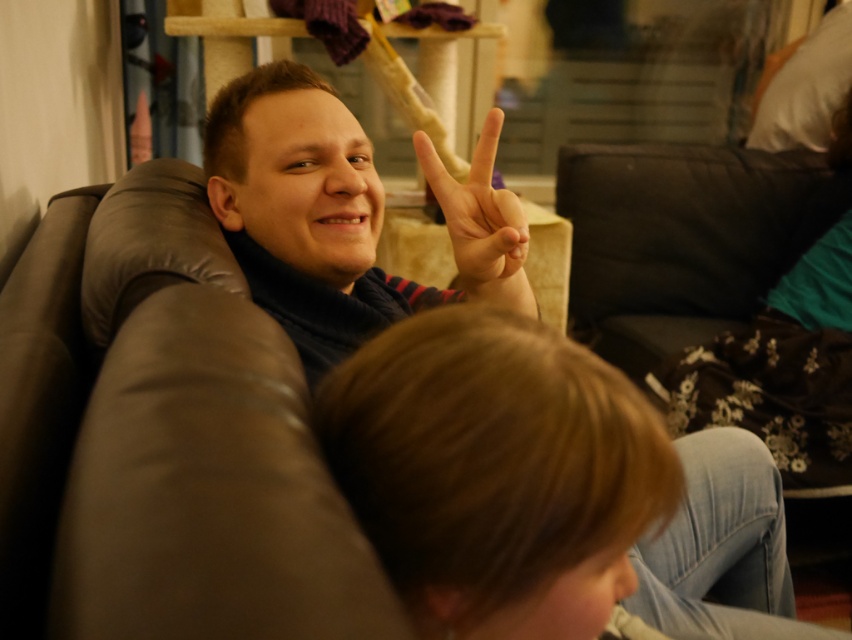
You are standing in the living room and want to place a small decoration on the matte black scarf at upper center. The coordinates given are point (341, 214). Can you confirm if this point is on the correct object?

Yes, the point (341, 214) is on the matte black scarf at upper center, so you can place the decoration there.

You are standing in the room and want to reach the point at coordinates (x=623, y=544). The cat tree is in your way. If the cat tree is 40 centimeters tall, can you step over it to reach the point?

The point at coordinates (x=623, y=544) is 43.18 centimeters away from the viewer. Since the cat tree is 40 centimeters tall, it is shorter than the distance to the point. Therefore, you can step over the cat tree to reach the point.

You are a photographer trying to capture a closeup of the matte black scarf at upper center and the matte black scarf at center. Which scarf is located to the right of the other?

The matte black scarf at upper center is positioned on the right side of the matte black scarf at center.